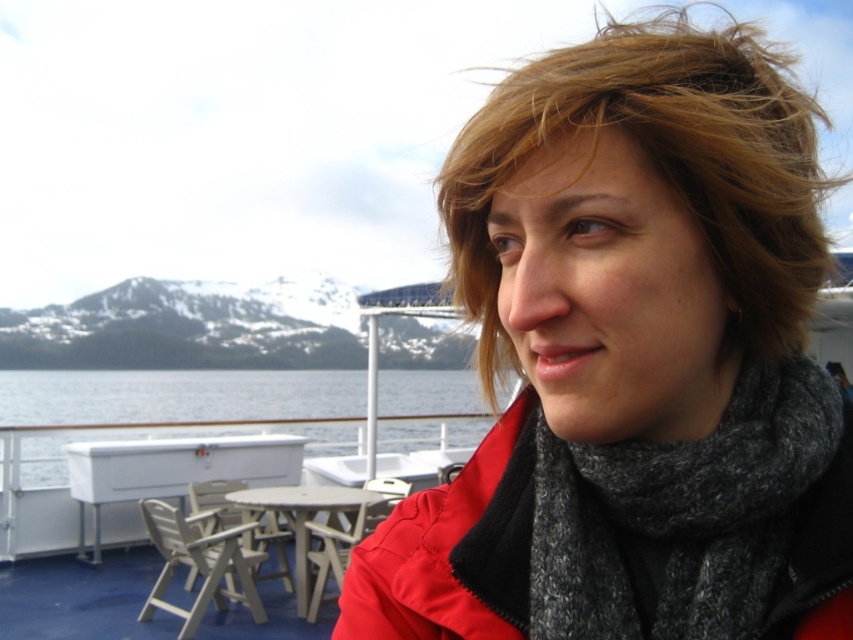
Based on the coordinates provided, can you identify which object in the scene is positioned at point (628,353)?

The matte red jacket at center is located at point (628,353).